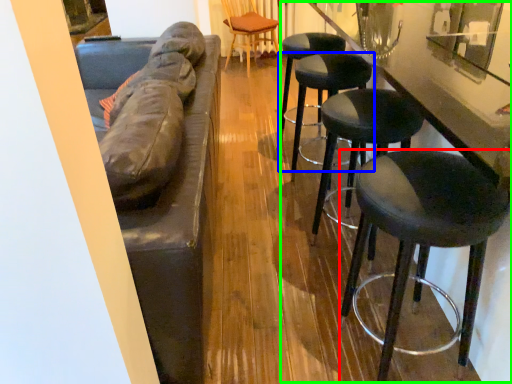
Question: Based on their relative distances, which object is nearer to stool (highlighted by a red box)? Choose from stool (highlighted by a blue box) and counter (highlighted by a green box).

Choices:
 (A) stool
 (B) counter

Answer: (B)